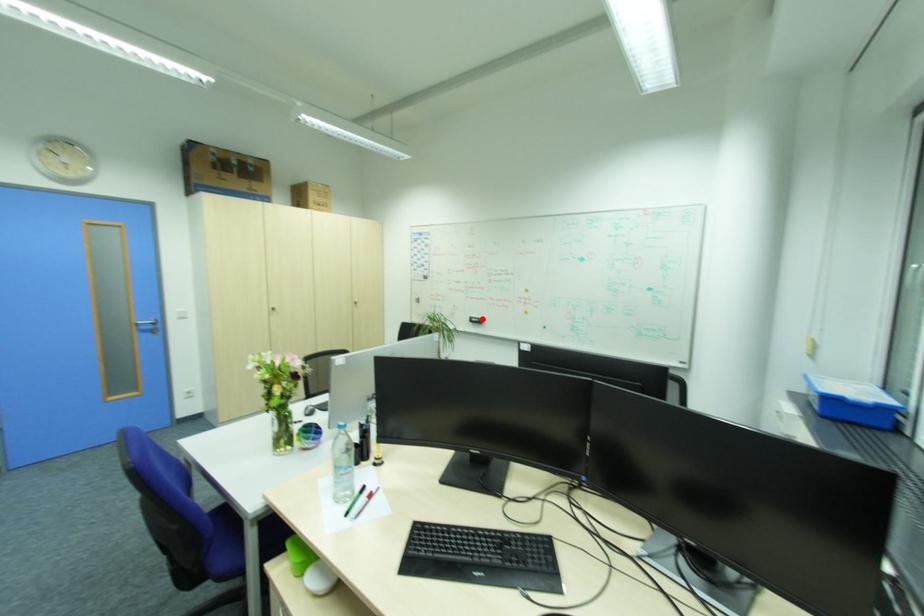
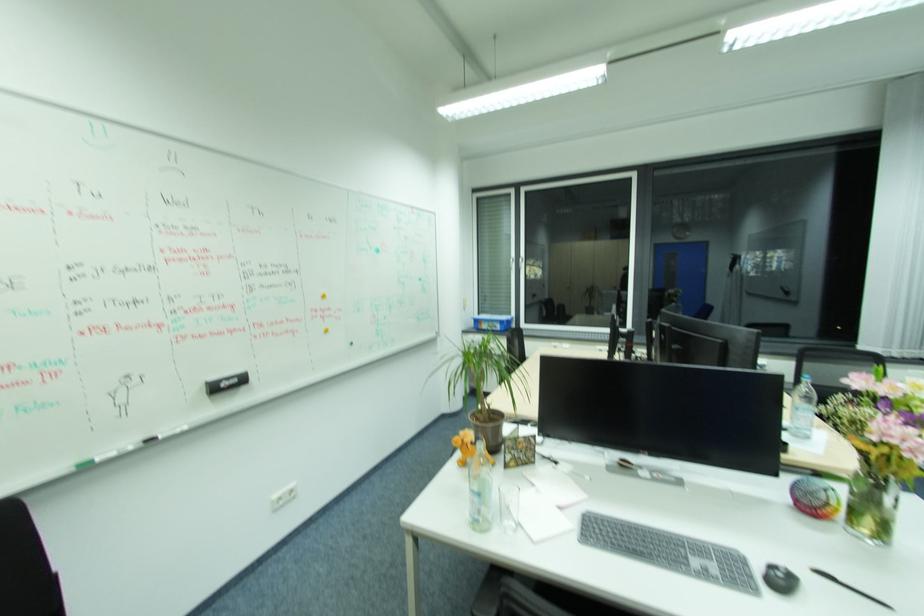
Find the pixel in the second image that matches the highlighted location in the first image.

(240, 381)